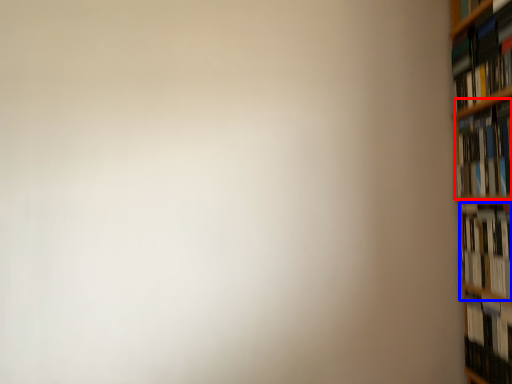
Question: Which object appears closest to the camera in this image, book (highlighted by a red box) or book (highlighted by a blue box)?

Choices:
 (A) book
 (B) book

Answer: (B)